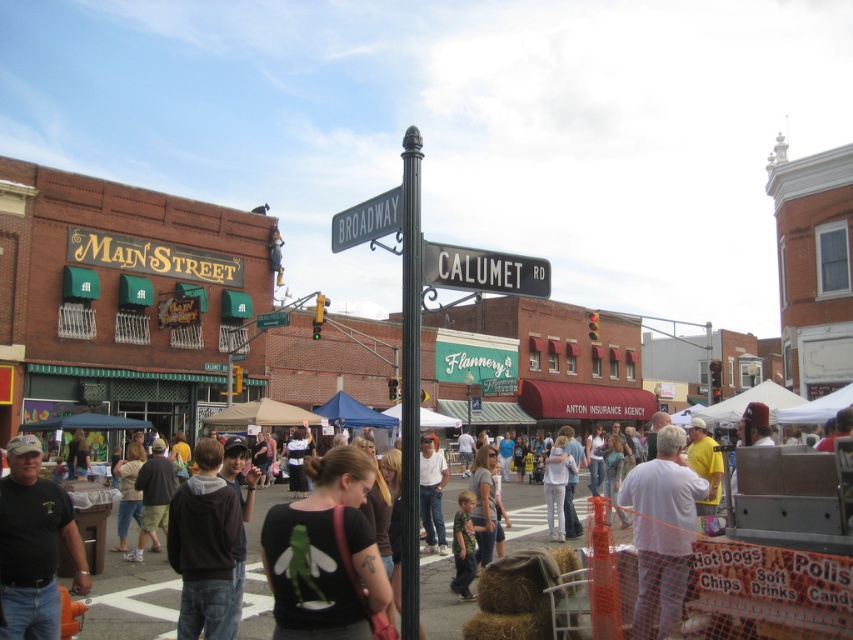
Question: Does dark gray hoodie at center appear on the right side of metallic silver street sign at center?

Choices:
 (A) no
 (B) yes

Answer: (B)

Question: Which object appears farthest from the camera in this image?

Choices:
 (A) black matte shirt at center
 (B) black metal street sign at center
 (C) dark gray hoodie at center
 (D) blue fabric canopy at center

Answer: (D)

Question: Which object appears closest to the camera in this image?

Choices:
 (A) metallic silver street sign at center
 (B) white fabric canopy at lower right
 (C) black t-shirt at lower left
 (D) green plastic street sign at upper center

Answer: (A)

Question: Which of the following is the farthest from the observer?

Choices:
 (A) white fabric canopy at lower right
 (B) black matte shirt at center

Answer: (A)

Question: Considering the relative positions of white cotton shirt at lower right and tan fabric canopy at center in the image provided, where is white cotton shirt at lower right located with respect to tan fabric canopy at center?

Choices:
 (A) right
 (B) left

Answer: (A)

Question: Is black matte shirt at center further to the viewer compared to dark gray hoodie at center?

Choices:
 (A) yes
 (B) no

Answer: (B)